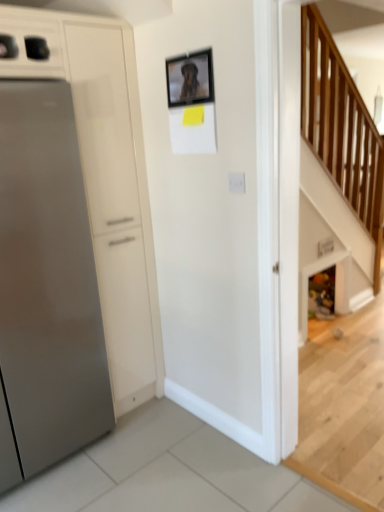
The width and height of the screenshot is (384, 512). What do you see at coordinates (107, 182) in the screenshot?
I see `satin white cabinet at left` at bounding box center [107, 182].

Locate an element on the screen. satin white cabinet at left is located at coordinates (107, 182).

Find the location of a particular element. This screenshot has height=512, width=384. satin white cabinet at left is located at coordinates (107, 182).